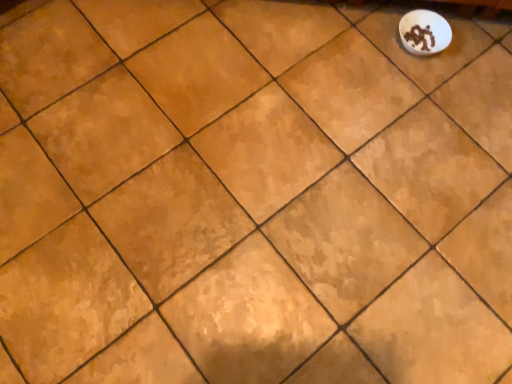
Find the location of `vacant space that is to the left of white glossy bowl at upper right`. vacant space that is to the left of white glossy bowl at upper right is located at coordinates (365, 42).